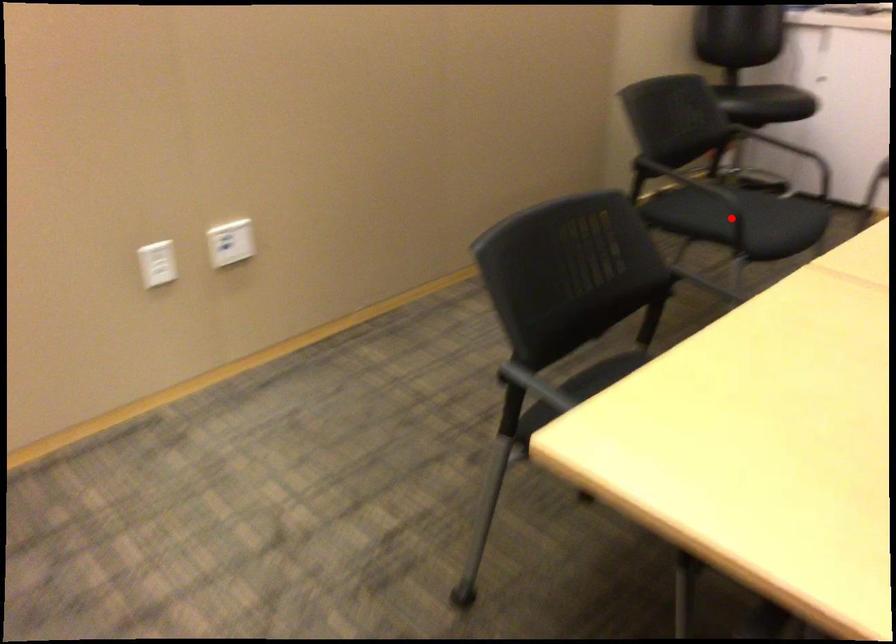
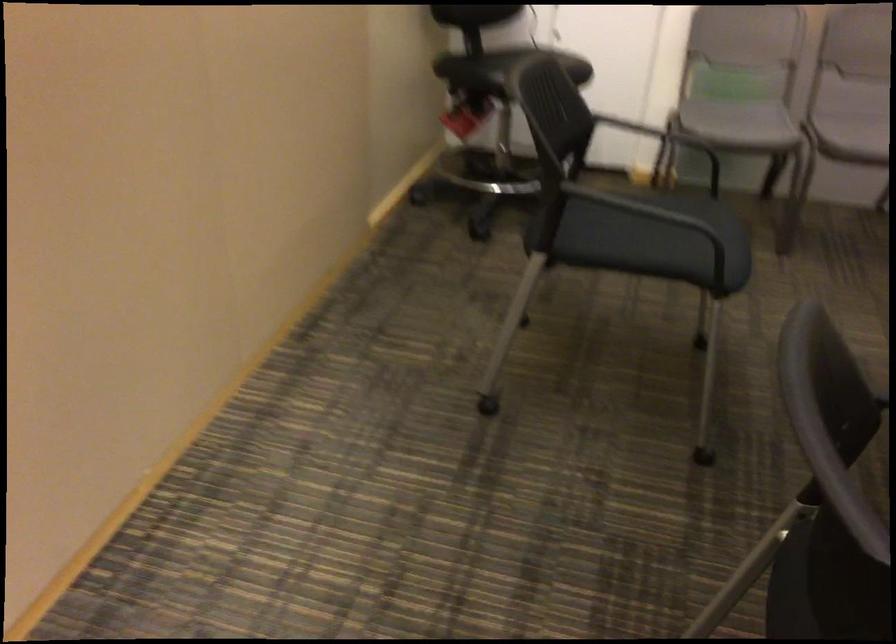
Question: I am providing you with two images of the same scene from different viewpoints. Given a red point in image1, look at the same physical point in image2. Is it:

Choices:
 (A) Closer to the viewpoint
 (B) Farther from the viewpoint

Answer: (A)